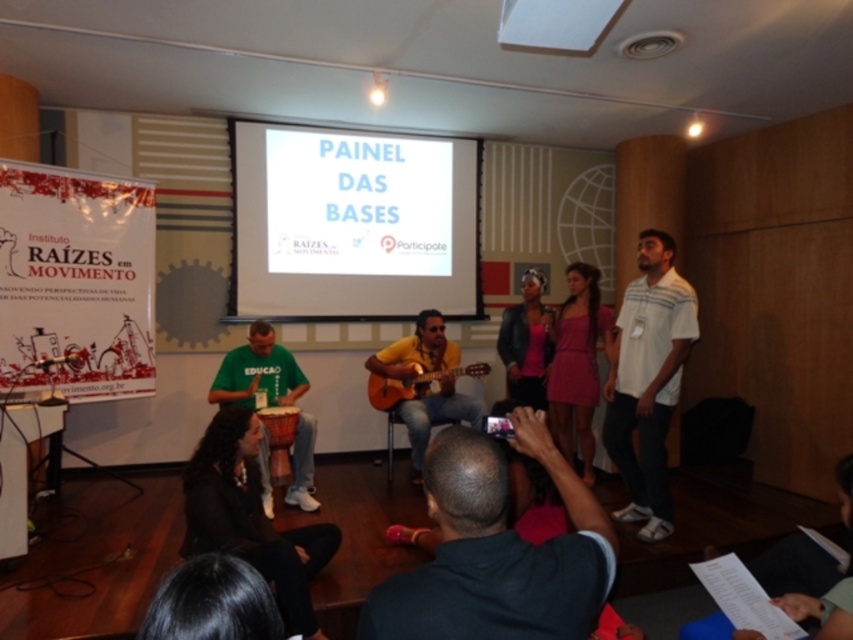
Between white matte projection screen at upper center and green fabric shirt at center, which one has less height?

With less height is green fabric shirt at center.

Is white matte projection screen at upper center shorter than green fabric shirt at center?

Incorrect, white matte projection screen at upper center's height does not fall short of green fabric shirt at center's.

Who is more distant from viewer, [329,131] or [289,387]?

The point [329,131] is behind.

Locate an element on the screen. white matte projection screen at upper center is located at coordinates (352, 224).

Which is above, dark gray hoodie at lower center or black leather jacket at lower left?

dark gray hoodie at lower center is higher up.

Between point (492, 454) and point (260, 541), which one is positioned in front?

Point (492, 454) is more forward.

Image resolution: width=853 pixels, height=640 pixels. What are the coordinates of `dark gray hoodie at lower center` in the screenshot? It's located at (496, 550).

Is point (329, 216) closer to camera compared to point (451, 541)?

No, (329, 216) is further to viewer.

Is white matte projection screen at upper center smaller than dark gray hoodie at lower center?

No, white matte projection screen at upper center is not smaller than dark gray hoodie at lower center.

Measure the distance between point (267,278) and camera.

A distance of 16.49 feet exists between point (267,278) and camera.

Locate an element on the screen. white matte projection screen at upper center is located at coordinates (352, 224).